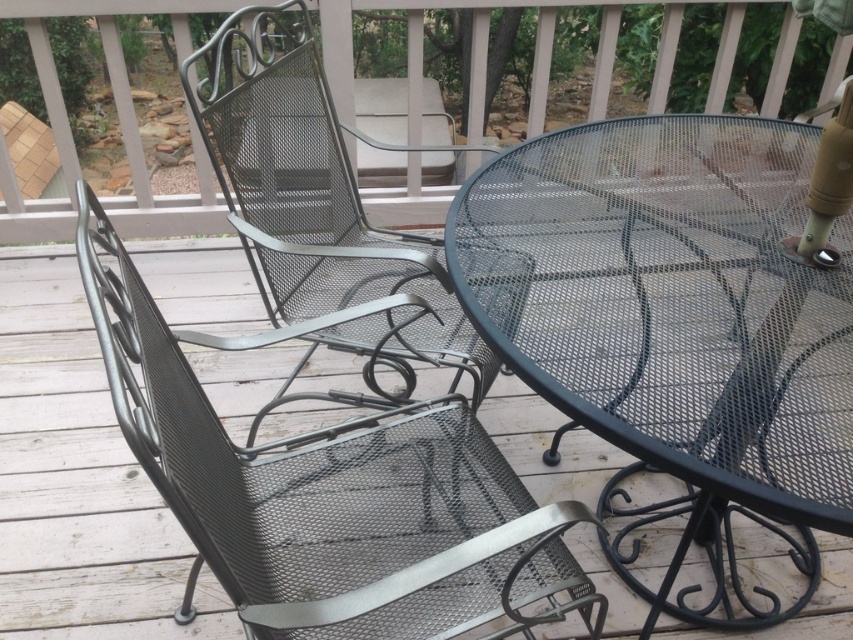
You are sitting on the metal mesh swivel chair at left and want to place a book on the black mesh table at center. Which direction should you move to reach the table?

The black mesh table at center is further to the viewer than the metal mesh swivel chair at left, so you should move forward to reach the table.

You are planning to place a small potted plant between the black mesh table at center and the wooden deck beneath it. Can the plant be placed directly under the table without touching either the table or the deck?

The distance between the black mesh table at center and the wooden deck beneath it is 35.71 inches. Since the plant needs space to be placed without touching either, there is sufficient vertical clearance. However, the question mentions placing it between the table and deck, which are vertically aligned. The horizontal placement between them isn not specified, so the vertical space allows it, but the horizontal positioning depends on the table dimensions not provided.